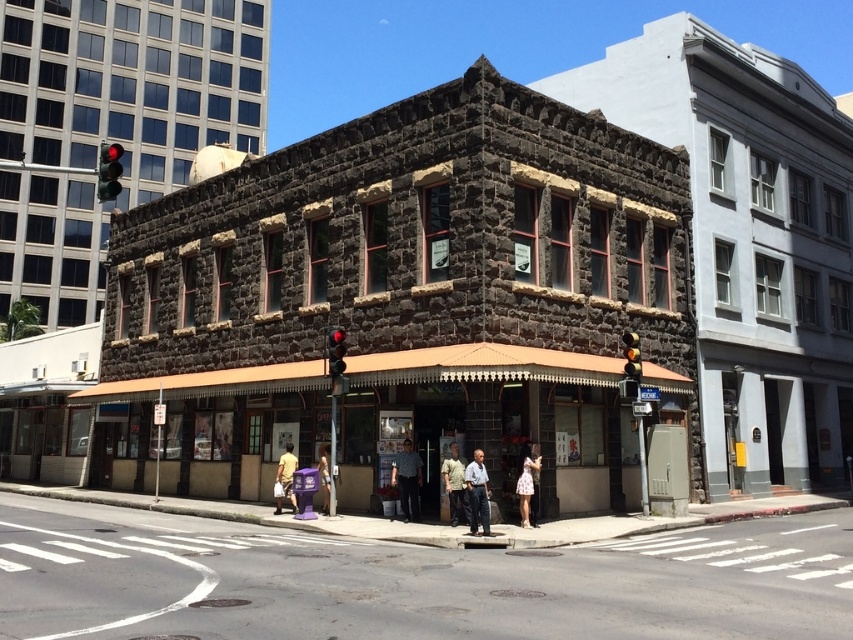
Question: Can you confirm if camouflage shirt at center is positioned below light brown fabric shirt at lower center?

Choices:
 (A) yes
 (B) no

Answer: (B)

Question: Which of these objects is positioned farthest from the red glass traffic light at center?

Choices:
 (A) dark stone building at center
 (B) light brown hair at center
 (C) red glass traffic light at upper left
 (D) yellow matte traffic light at upper right

Answer: (C)

Question: Can you confirm if light blue shirt at center is thinner than red glass traffic light at center?

Choices:
 (A) no
 (B) yes

Answer: (A)

Question: Considering the relative positions of red glass traffic light at upper left and light brown hair at center in the image provided, where is red glass traffic light at upper left located with respect to light brown hair at center?

Choices:
 (A) left
 (B) right

Answer: (A)

Question: Which point is farther to the camera?

Choices:
 (A) red glass traffic light at upper left
 (B) camouflage shirt at center

Answer: (B)

Question: Among these objects, which one is nearest to the camera?

Choices:
 (A) light blue shirt at center
 (B) light brown fabric shirt at lower center
 (C) light brown hair at center

Answer: (A)